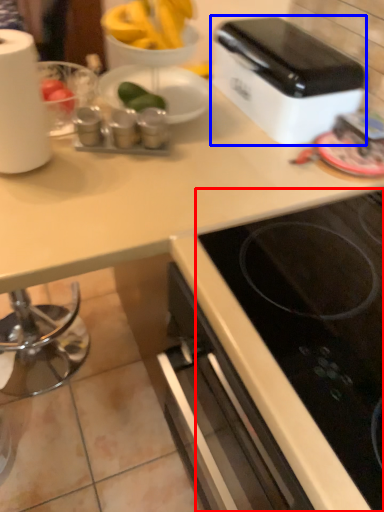
Question: Which object is further to the camera taking this photo, gas stove (highlighted by a red box) or toaster (highlighted by a blue box)?

Choices:
 (A) gas stove
 (B) toaster

Answer: (B)